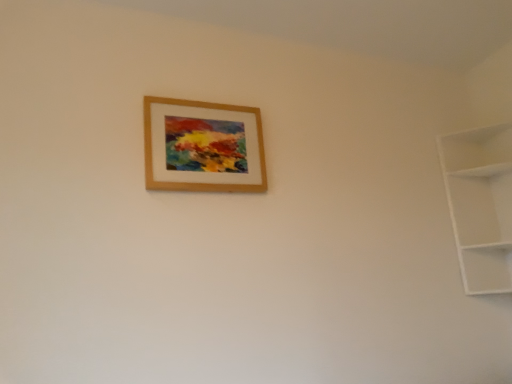
Question: Do you think white matte shelf at right is within wooden picture frame at upper center, or outside of it?

Choices:
 (A) outside
 (B) inside

Answer: (A)

Question: Considering the positions of white matte shelf at right and wooden picture frame at upper center in the image, is white matte shelf at right bigger or smaller than wooden picture frame at upper center?

Choices:
 (A) small
 (B) big

Answer: (B)

Question: Does point (504, 158) appear closer or farther from the camera than point (201, 120)?

Choices:
 (A) farther
 (B) closer

Answer: (A)

Question: Is wooden picture frame at upper center wider or thinner than white matte shelf at right?

Choices:
 (A) wide
 (B) thin

Answer: (B)

Question: Relative to white matte shelf at right, is wooden picture frame at upper center in front or behind?

Choices:
 (A) behind
 (B) front

Answer: (B)

Question: Looking at the image, does wooden picture frame at upper center seem bigger or smaller compared to white matte shelf at right?

Choices:
 (A) small
 (B) big

Answer: (A)

Question: Is wooden picture frame at upper center situated inside white matte shelf at right or outside?

Choices:
 (A) inside
 (B) outside

Answer: (B)